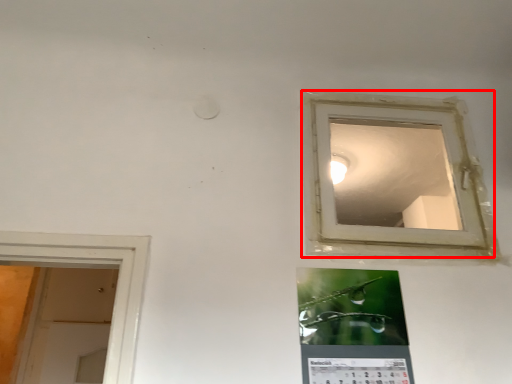
Question: From the image's perspective, where is window (annotated by the red box) located relative to bulletin board?

Choices:
 (A) above
 (B) below

Answer: (A)